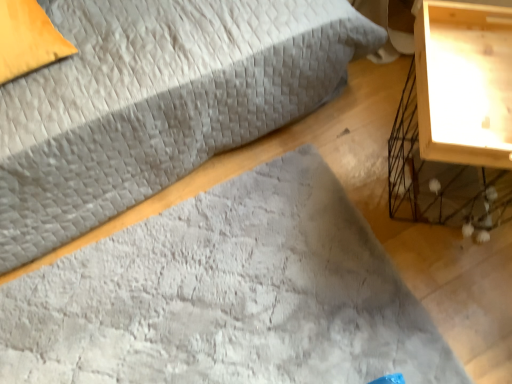
What do you see at coordinates (156, 102) in the screenshot? I see `velvet gray bed at center` at bounding box center [156, 102].

The image size is (512, 384). What do you see at coordinates (453, 123) in the screenshot?
I see `wooden nightstand at right` at bounding box center [453, 123].

What are the coordinates of `velvet gray bed at center` in the screenshot? It's located at (156, 102).

Considering the positions of point (455, 26) and point (5, 54), is point (455, 26) closer or farther from the camera than point (5, 54)?

Clearly, point (455, 26) is more distant from the camera than point (5, 54).

From a real-world perspective, who is located lower, wooden nightstand at right or orange fabric pillow at upper left?

wooden nightstand at right is physically lower.

Where is `furniture below the orange fabric pillow at upper left (from the image's perspective)`? This screenshot has width=512, height=384. furniture below the orange fabric pillow at upper left (from the image's perspective) is located at coordinates (453, 123).

Is orange fabric pillow at upper left surrounded by wooden nightstand at right?

No, wooden nightstand at right does not contain orange fabric pillow at upper left.

Between velvet gray bed at center and textured gray mat at center, which one has larger size?

Bigger between the two is velvet gray bed at center.

Is velvet gray bed at center facing away from textured gray mat at center?

velvet gray bed at center does not have its back to textured gray mat at center.

Where is `bed located above the textured gray mat at center (from the image's perspective)`? Image resolution: width=512 pixels, height=384 pixels. bed located above the textured gray mat at center (from the image's perspective) is located at coordinates (156, 102).

Is wooden nightstand at right positioned far away from velvet gray bed at center?

Actually, wooden nightstand at right and velvet gray bed at center are a little close together.

Which object is positioned more to the left, wooden nightstand at right or velvet gray bed at center?

Positioned to the left is velvet gray bed at center.

From a real-world perspective, is wooden nightstand at right beneath velvet gray bed at center?

Yes, from a real-world perspective, wooden nightstand at right is beneath velvet gray bed at center.

Is wooden nightstand at right situated inside velvet gray bed at center or outside?

wooden nightstand at right is spatially situated outside velvet gray bed at center.

Does textured gray mat at center have a greater width compared to orange fabric pillow at upper left?

Indeed, textured gray mat at center has a greater width compared to orange fabric pillow at upper left.

From the image's perspective, is textured gray mat at center located above orange fabric pillow at upper left?

Actually, textured gray mat at center appears below orange fabric pillow at upper left in the image.

Is textured gray mat at center taller or shorter than orange fabric pillow at upper left?

Clearly, textured gray mat at center is shorter compared to orange fabric pillow at upper left.

Are orange fabric pillow at upper left and velvet gray bed at center beside each other?

No, orange fabric pillow at upper left is not next to velvet gray bed at center.

What's the angular difference between orange fabric pillow at upper left and velvet gray bed at center's facing directions?

The angle between the facing direction of orange fabric pillow at upper left and the facing direction of velvet gray bed at center is 7.05 degrees.

Considering the relative sizes of orange fabric pillow at upper left and velvet gray bed at center in the image provided, is orange fabric pillow at upper left shorter than velvet gray bed at center?

Indeed, orange fabric pillow at upper left has a lesser height compared to velvet gray bed at center.

Is orange fabric pillow at upper left smaller than velvet gray bed at center?

Yes, orange fabric pillow at upper left is smaller than velvet gray bed at center.

Measure the distance from textured gray mat at center to velvet gray bed at center.

13.87 inches.

Considering the positions of point (123, 271) and point (23, 81), is point (123, 271) closer or farther from the camera than point (23, 81)?

Point (123, 271) appears to be farther away from the viewer than point (23, 81).

Is textured gray mat at center taller or shorter than velvet gray bed at center?

textured gray mat at center is shorter than velvet gray bed at center.

Which object is further away from the camera, textured gray mat at center or wooden nightstand at right?

textured gray mat at center is further away from the camera.

From the picture: Can you confirm if textured gray mat at center is taller than wooden nightstand at right?

In fact, textured gray mat at center may be shorter than wooden nightstand at right.

Who is smaller, textured gray mat at center or wooden nightstand at right?

With smaller size is textured gray mat at center.

Is textured gray mat at center far away from wooden nightstand at right?

No.

Locate an element on the screen. The height and width of the screenshot is (384, 512). furniture lying below the orange fabric pillow at upper left (from the image's perspective) is located at coordinates (453, 123).

You are a GUI agent. You are given a task and a screenshot of the screen. Output one action in this format:
    pyautogui.click(x=<x>, y=<y>)
    Task: Click on the bed above the textured gray mat at center (from a real-world perspective)
    Image resolution: width=512 pixels, height=384 pixels.
    Given the screenshot: What is the action you would take?
    pyautogui.click(x=156, y=102)

Which object lies further to the anchor point textured gray mat at center, velvet gray bed at center or orange fabric pillow at upper left?

orange fabric pillow at upper left is further to textured gray mat at center.

Based on their spatial positions, is wooden nightstand at right or textured gray mat at center closer to orange fabric pillow at upper left?

Among the two, textured gray mat at center is located nearer to orange fabric pillow at upper left.

Looking at the image, which one is located further to wooden nightstand at right, textured gray mat at center or orange fabric pillow at upper left?

orange fabric pillow at upper left lies further to wooden nightstand at right than the other object.

From the image, which object appears to be farther from orange fabric pillow at upper left, textured gray mat at center or velvet gray bed at center?

textured gray mat at center is positioned further to the anchor orange fabric pillow at upper left.

Which object lies further to the anchor point velvet gray bed at center, orange fabric pillow at upper left or textured gray mat at center?

textured gray mat at center.

Looking at the image, which one is located further to textured gray mat at center, velvet gray bed at center or wooden nightstand at right?

wooden nightstand at right lies further to textured gray mat at center than the other object.

Consider the image. Estimate the real-world distances between objects in this image. Which object is closer to velvet gray bed at center, textured gray mat at center or wooden nightstand at right?

The object closer to velvet gray bed at center is textured gray mat at center.

When comparing their distances from orange fabric pillow at upper left, does wooden nightstand at right or velvet gray bed at center seem further?

wooden nightstand at right is further to orange fabric pillow at upper left.

Where is `mat situated between velvet gray bed at center and wooden nightstand at right from left to right`? The image size is (512, 384). mat situated between velvet gray bed at center and wooden nightstand at right from left to right is located at coordinates (227, 295).

Image resolution: width=512 pixels, height=384 pixels. What are the coordinates of `bed between orange fabric pillow at upper left and wooden nightstand at right from left to right` in the screenshot? It's located at (156, 102).

Where is `mat between orange fabric pillow at upper left and wooden nightstand at right from left to right`? The width and height of the screenshot is (512, 384). mat between orange fabric pillow at upper left and wooden nightstand at right from left to right is located at coordinates (227, 295).

Image resolution: width=512 pixels, height=384 pixels. What are the coordinates of `pillow between velvet gray bed at center and textured gray mat at center in the up-down direction` in the screenshot? It's located at (28, 39).